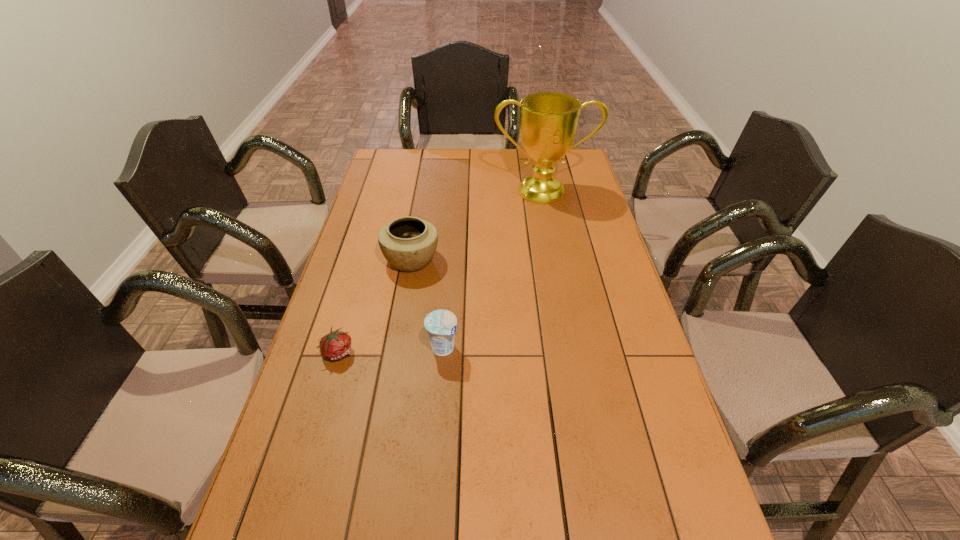
Where is `free location located 0.340m on the right of the tomato`? free location located 0.340m on the right of the tomato is located at coordinates (483, 352).

This screenshot has width=960, height=540. I want to click on pottery positioned at the left edge, so click(x=408, y=243).

Find the location of `tomato located at the left edge`. tomato located at the left edge is located at coordinates (336, 345).

Where is `object located in the right edge section of the desktop`? This screenshot has width=960, height=540. object located in the right edge section of the desktop is located at coordinates (548, 121).

What are the coordinates of `vacant space at the far edge of the desktop` in the screenshot? It's located at (468, 173).

In the image, there is a desktop. Where is `free region at the left edge`? The width and height of the screenshot is (960, 540). free region at the left edge is located at coordinates [x=366, y=208].

Where is `free space at the right edge of the desktop`? Image resolution: width=960 pixels, height=540 pixels. free space at the right edge of the desktop is located at coordinates (631, 350).

This screenshot has width=960, height=540. I want to click on vacant space at the far left corner of the desktop, so pyautogui.click(x=390, y=165).

At what (x,y) coordinates should I click in order to perform the action: click on free space that is in between the farthest object and the second farthest object. Please return your answer as a coordinate pair (x, y). The height and width of the screenshot is (540, 960). Looking at the image, I should click on (477, 225).

Locate an element on the screen. The image size is (960, 540). free space between the award and the tomato is located at coordinates (441, 271).